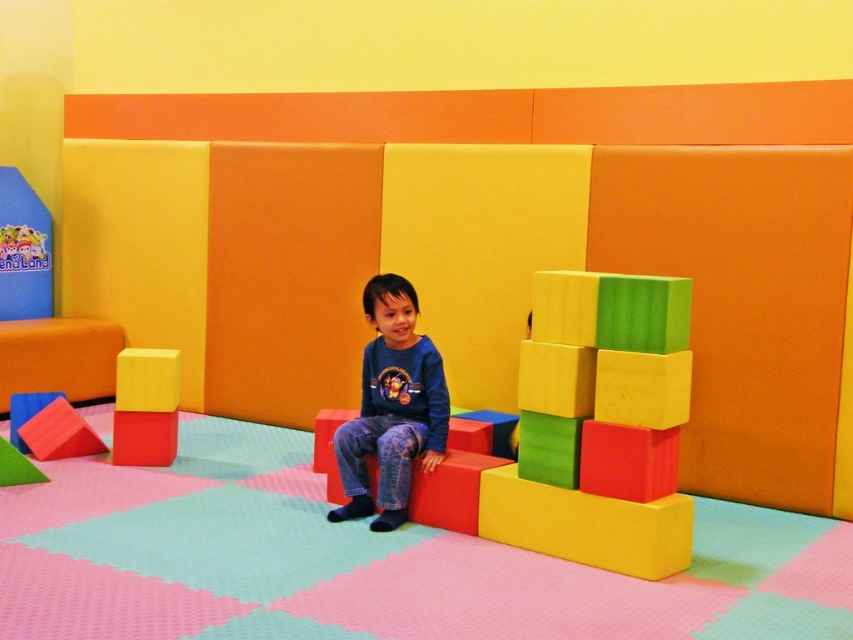
Question: Estimate the real-world distances between objects in this image. Which object is closer to the rubber foam blocks at center?

Choices:
 (A) matte yellow foam block at center
 (B) rubberized foam cube at center

Answer: (A)

Question: Is blue cotton shirt at center behind matte yellow foam block at center?

Choices:
 (A) no
 (B) yes

Answer: (A)

Question: Is blue cotton shirt at center below matte yellow foam block at center?

Choices:
 (A) yes
 (B) no

Answer: (B)

Question: Which object appears closest to the camera in this image?

Choices:
 (A) blue cotton shirt at center
 (B) rubberized foam cube at center
 (C) rubber foam blocks at center
 (D) matte yellow foam block at center

Answer: (C)

Question: Can you confirm if rubber foam blocks at center is wider than blue cotton shirt at center?

Choices:
 (A) no
 (B) yes

Answer: (B)

Question: Which object is the farthest from the rubber foam blocks at center?

Choices:
 (A) rubberized foam cube at center
 (B) matte yellow foam block at center

Answer: (A)